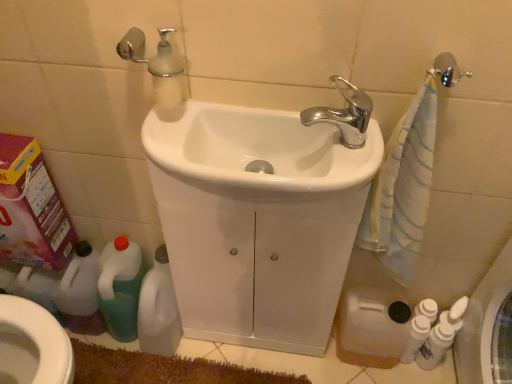
The width and height of the screenshot is (512, 384). I want to click on vacant area that is in front of white plastic bottle at lower left, positioned as the third cleaning product in right-to-left order, so click(x=163, y=365).